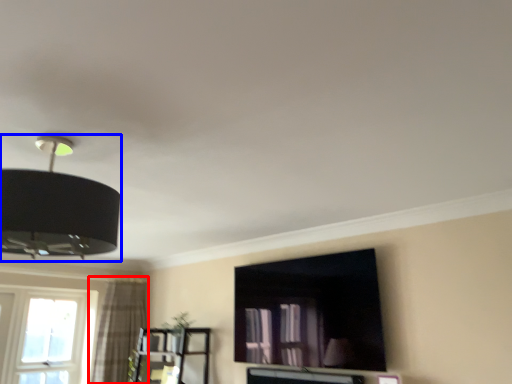
Question: Among these objects, which one is nearest to the camera, curtain (highlighted by a red box) or lamp (highlighted by a blue box)?

Choices:
 (A) curtain
 (B) lamp

Answer: (B)